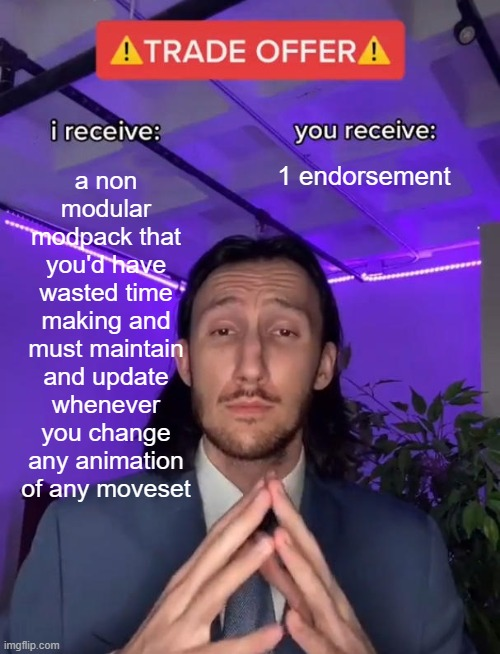
Identify the location of plant middle right. (461, 462).